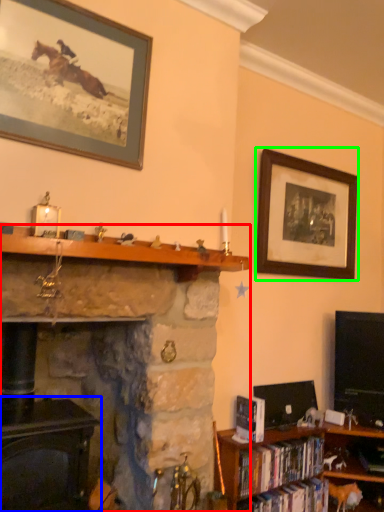
Question: Which object is positioned farthest from fireplace (highlighted by a red box)? Select from fireplace (highlighted by a blue box) and picture frame (highlighted by a green box).

Choices:
 (A) fireplace
 (B) picture frame

Answer: (B)